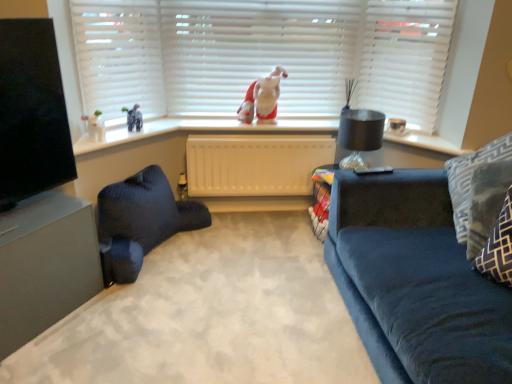
Identify the location of empty space that is ontop of velvet dark blue armchair at lower left. This screenshot has width=512, height=384. (202, 316).